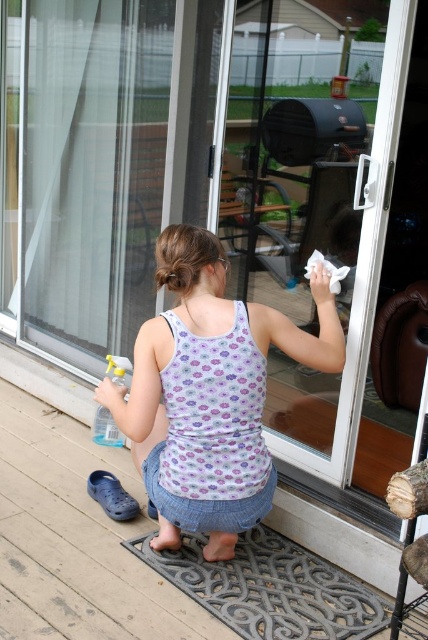
Based on the photo, who is taller, floral tank top at center or wooden deck at lower left?

floral tank top at center

Identify the location of floral tank top at center. Image resolution: width=428 pixels, height=640 pixels. (210, 387).

What do you see at coordinates (210, 387) in the screenshot?
I see `floral tank top at center` at bounding box center [210, 387].

Which is behind, point (154, 346) or point (107, 440)?

Positioned behind is point (107, 440).

Which is in front, point (243, 314) or point (110, 428)?

Point (243, 314)

This screenshot has width=428, height=640. Find the location of `floral tank top at center`. floral tank top at center is located at coordinates (210, 387).

Looking at this image, which is below, wooden deck at lower left or clear plastic spray bottle at lower left?

wooden deck at lower left is below.

Does wooden deck at lower left have a greater height compared to clear plastic spray bottle at lower left?

Correct, wooden deck at lower left is much taller as clear plastic spray bottle at lower left.

Image resolution: width=428 pixels, height=640 pixels. What do you see at coordinates (74, 541) in the screenshot?
I see `wooden deck at lower left` at bounding box center [74, 541].

At what (x,y) coordinates should I click in order to perform the action: click on wooden deck at lower left. Please return your answer as a coordinate pair (x, y). This screenshot has height=640, width=428. Looking at the image, I should click on (74, 541).